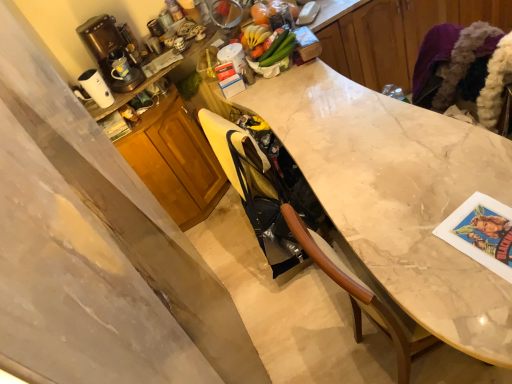
Question: From a real-world perspective, is brown plastic coffee machine at upper left located higher than wooden cabinet at center, marked as the second cabinetry in a top-to-bottom arrangement?

Choices:
 (A) no
 (B) yes

Answer: (B)

Question: From the image's perspective, is brown plastic coffee machine at upper left on wooden cabinet at center, marked as the second cabinetry in a top-to-bottom arrangement?

Choices:
 (A) no
 (B) yes

Answer: (B)

Question: From a real-world perspective, is brown plastic coffee machine at upper left beneath wooden cabinet at center, positioned as the first cabinetry in left-to-right order?

Choices:
 (A) yes
 (B) no

Answer: (B)

Question: Considering the relative sizes of brown plastic coffee machine at upper left and wooden cabinet at center, which is the second cabinetry in right-to-left order, in the image provided, is brown plastic coffee machine at upper left shorter than wooden cabinet at center, which is the second cabinetry in right-to-left order,?

Choices:
 (A) no
 (B) yes

Answer: (B)

Question: Is wooden cabinet at center, which is the second cabinetry in right-to-left order, inside brown plastic coffee machine at upper left?

Choices:
 (A) no
 (B) yes

Answer: (A)

Question: Is brown plastic coffee machine at upper left oriented towards wooden cabinet at center, which is the 1th cabinetry from bottom to top?

Choices:
 (A) yes
 (B) no

Answer: (B)

Question: Is the position of marble at center more distant than that of brown plastic coffee machine at upper left?

Choices:
 (A) no
 (B) yes

Answer: (A)

Question: Does marble at center have a greater height compared to brown plastic coffee machine at upper left?

Choices:
 (A) no
 (B) yes

Answer: (B)

Question: Considering the relative sizes of marble at center and brown plastic coffee machine at upper left in the image provided, is marble at center thinner than brown plastic coffee machine at upper left?

Choices:
 (A) yes
 (B) no

Answer: (B)

Question: Considering the relative sizes of marble at center and brown plastic coffee machine at upper left in the image provided, is marble at center wider than brown plastic coffee machine at upper left?

Choices:
 (A) no
 (B) yes

Answer: (B)

Question: Is marble at center at the left side of brown plastic coffee machine at upper left?

Choices:
 (A) yes
 (B) no

Answer: (B)

Question: Is marble at center in front of brown plastic coffee machine at upper left?

Choices:
 (A) no
 (B) yes

Answer: (B)

Question: Is wooden cabinet at center, which is the 1th cabinetry from bottom to top, in contact with white marble countertop at center, the first cabinetry viewed from the top?

Choices:
 (A) yes
 (B) no

Answer: (B)